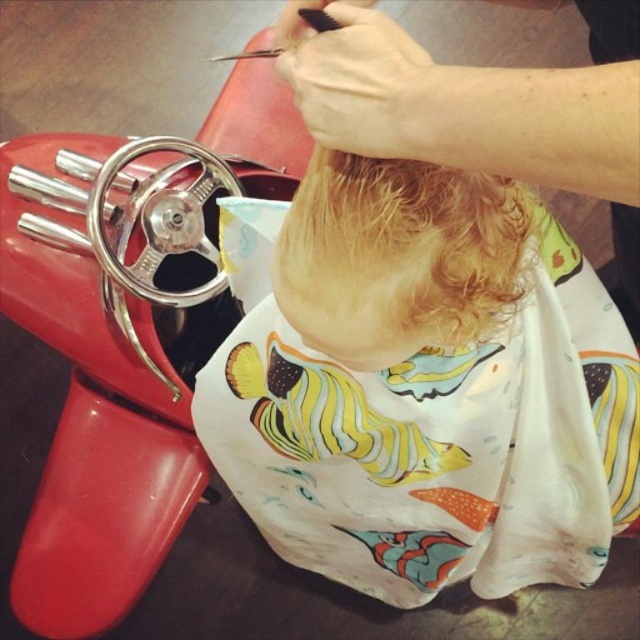
Is blonde hair at center bigger than black plastic comb at upper center?

Indeed, blonde hair at center has a larger size compared to black plastic comb at upper center.

The width and height of the screenshot is (640, 640). I want to click on blonde hair at center, so click(x=420, y=384).

Who is higher up, blonde hair at center or curly blonde hair at center?

curly blonde hair at center

Which of these two, blonde hair at center or curly blonde hair at center, stands taller?

With more height is blonde hair at center.

Is point (257, 212) positioned before point (508, 256)?

No, (257, 212) is behind (508, 256).

Where is `blonde hair at center`? Image resolution: width=640 pixels, height=640 pixels. blonde hair at center is located at coordinates (420, 384).

Does point (328, 246) lie behind point (316, 10)?

Yes, point (328, 246) is farther from viewer.

Which of these two, curly blonde hair at center or black plastic comb at upper center, stands taller?

With more height is curly blonde hair at center.

What do you see at coordinates (401, 257) in the screenshot? This screenshot has height=640, width=640. I see `curly blonde hair at center` at bounding box center [401, 257].

The width and height of the screenshot is (640, 640). Identify the location of curly blonde hair at center. (401, 257).